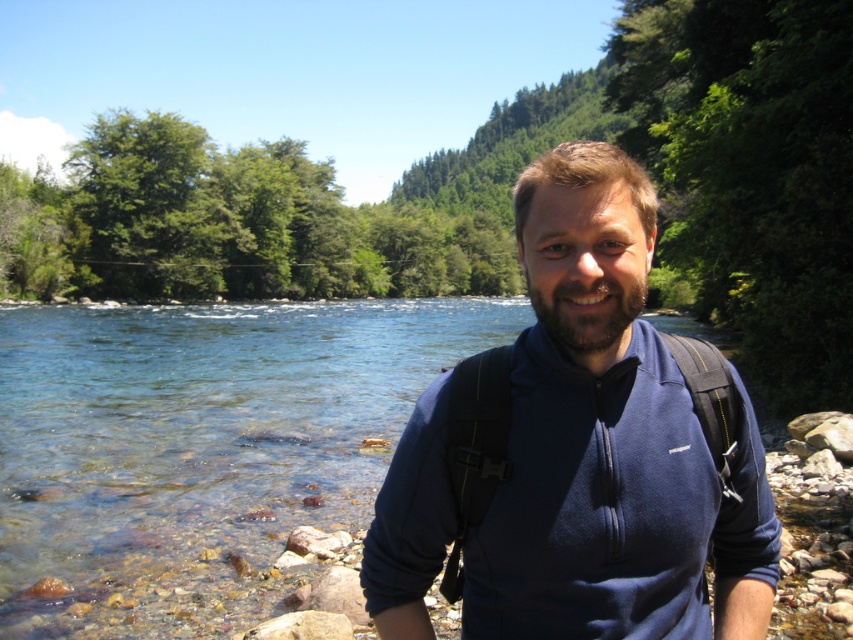
In the scene shown: You are a photographer trying to capture the two points in the image. Which point is closer to the camera, point (55, 317) or point (549, 288)?

A: Point (55, 317) is further to the viewer than point (549, 288), so the closer point to the camera is point (549, 288).

You are planning to cross the river using a small raft that can only carry items as wide as the blue fleece jacket at center. Based on the scene, can the raft safely carry the clear water at river right?

The clear water at river right is wider than the blue fleece jacket at center. Since the raft can only carry items as wide as the jacket, the clear water at river right cannot be safely carried on the raft due to its greater width.